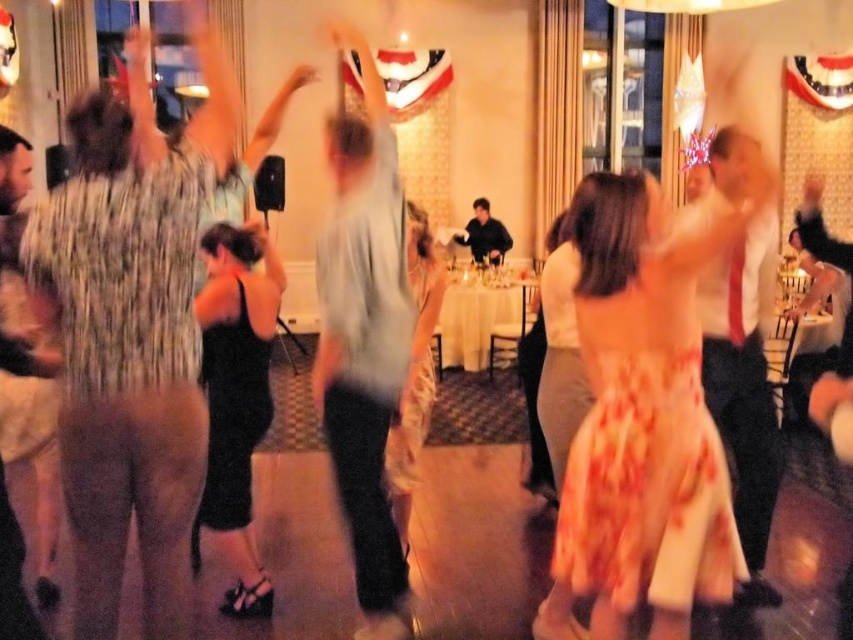
Question: Which point is farther from the camera taking this photo?

Choices:
 (A) (x=361, y=346)
 (B) (x=213, y=349)
 (C) (x=491, y=248)
 (D) (x=175, y=436)

Answer: (C)

Question: Among these points, which one is farthest from the camera?

Choices:
 (A) (694, 390)
 (B) (219, 404)
 (C) (335, 184)
 (D) (753, 573)

Answer: (D)

Question: Does matte white shirt at center have a greater width compared to black satin dress at center?

Choices:
 (A) yes
 (B) no

Answer: (A)

Question: Does light gray cotton shirt at center have a smaller size compared to matte white shirt at center?

Choices:
 (A) no
 (B) yes

Answer: (B)

Question: Which object is positioned closest to the light gray cotton shirt at center?

Choices:
 (A) shiny metallic dress at left
 (B) black satin dress at center
 (C) floral-patterned fabric dress at center
 (D) matte white shirt at center

Answer: (B)

Question: Is light gray cotton shirt at center wider than matte white shirt at center?

Choices:
 (A) yes
 (B) no

Answer: (B)